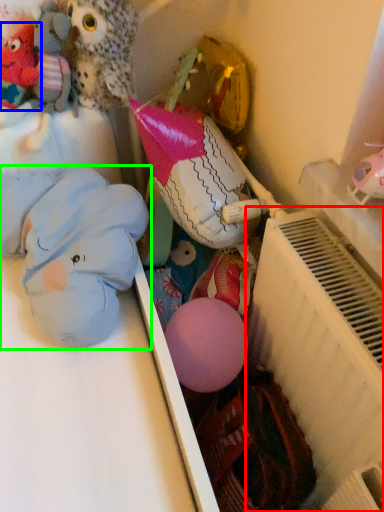
Question: Which object is the closest to the radiator (highlighted by a red box)? Choose among these: toy (highlighted by a blue box) or toy (highlighted by a green box).

Choices:
 (A) toy
 (B) toy

Answer: (B)